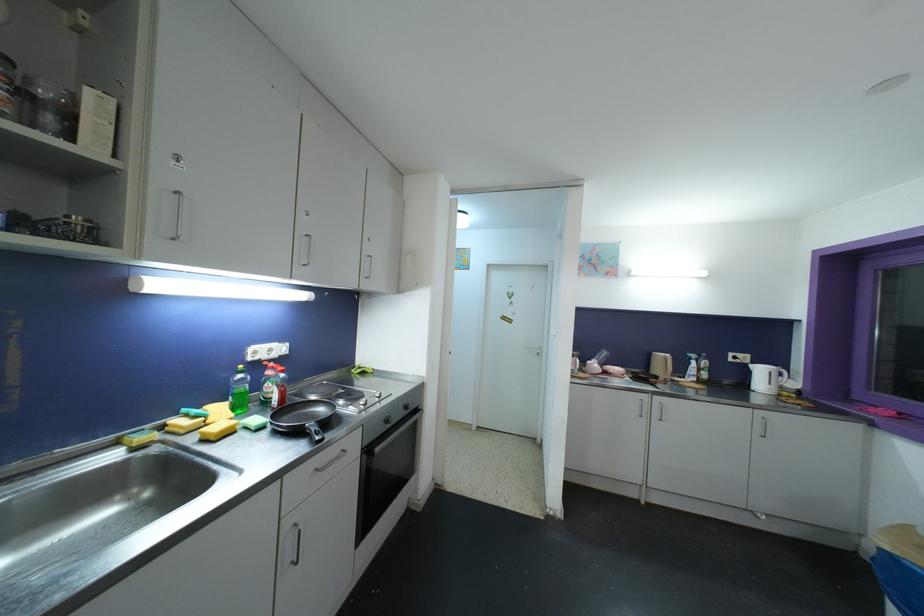
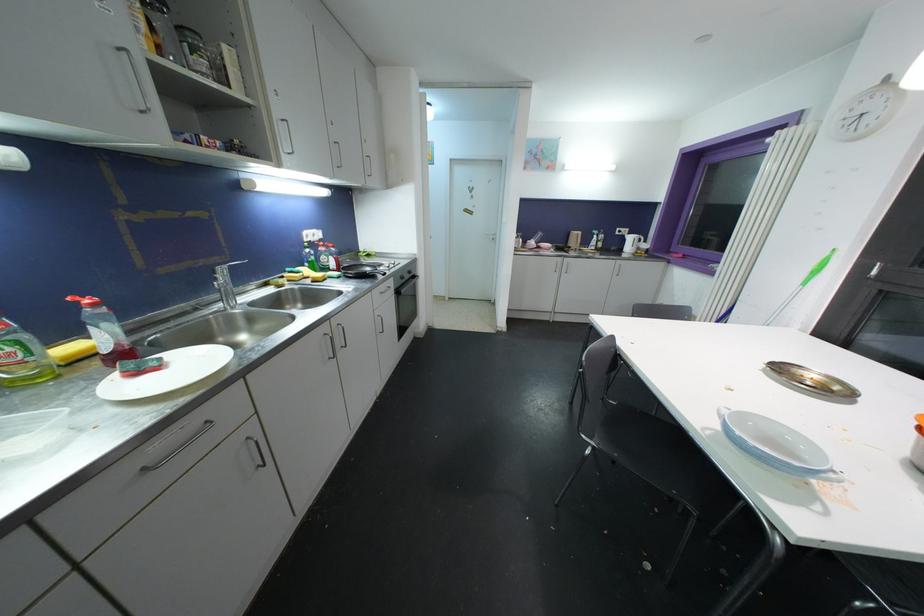
The point at (763, 373) is marked in the first image. Where is the corresponding point in the second image?

(634, 241)